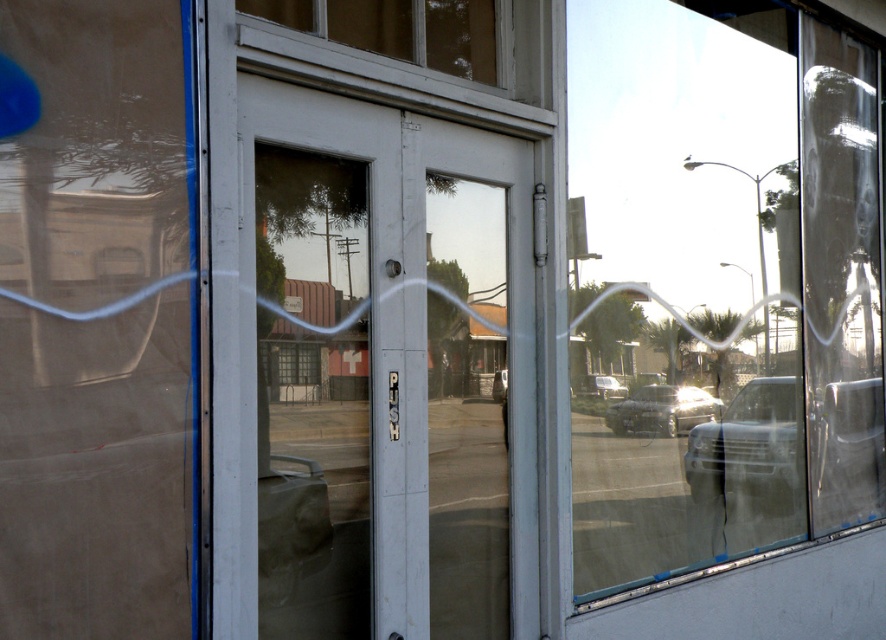
You are a delivery person approaching the storefront and see the metallic silver suv at center and the metallic silver sedan at center reflected in the glass door. Which vehicle is closer to the door based on their reflection?

The metallic silver sedan at center is behind the metallic silver suv at center in the reflection, so the metallic silver suv at center is closer to the door.

You are a delivery person trying to enter the store. You see the transparent glass door at center and the clear glass window at upper center. Which one should you push to enter the store?

You should push the transparent glass door at center to enter the store because the clear glass window at upper center is likely fixed and not meant for entry, as the PUSH sign is on the door.

You are standing in front of the storefront and want to enter. The transparent glass door at center and the clear glass window at upper center are both in front of you. Which one do you need to push to open the entrance?

The transparent glass door at center is further to the viewer than the clear glass window at upper center, so you should push the transparent glass door at center to open the entrance since it is closer to you.